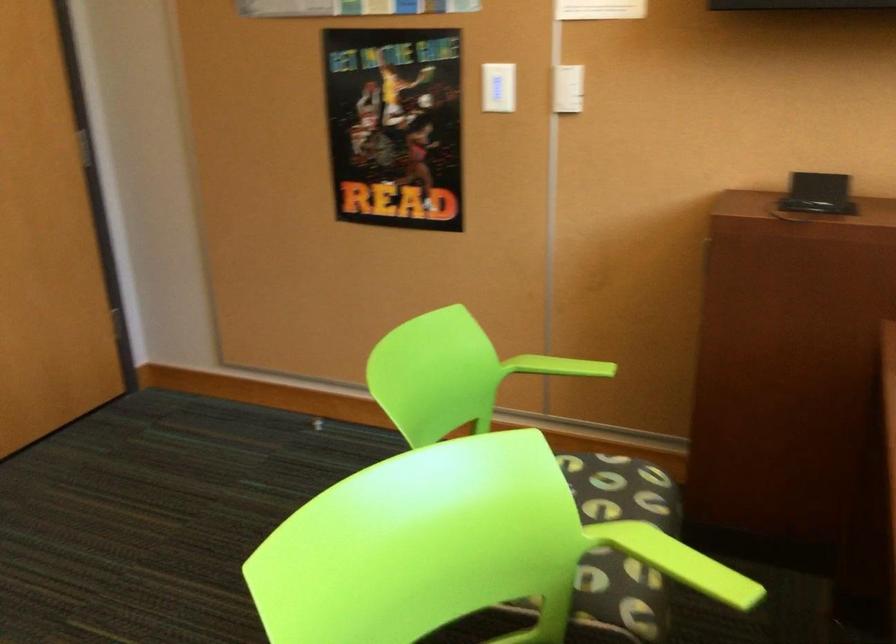
The location [817,194] corresponds to which object?

It refers to a small black device.